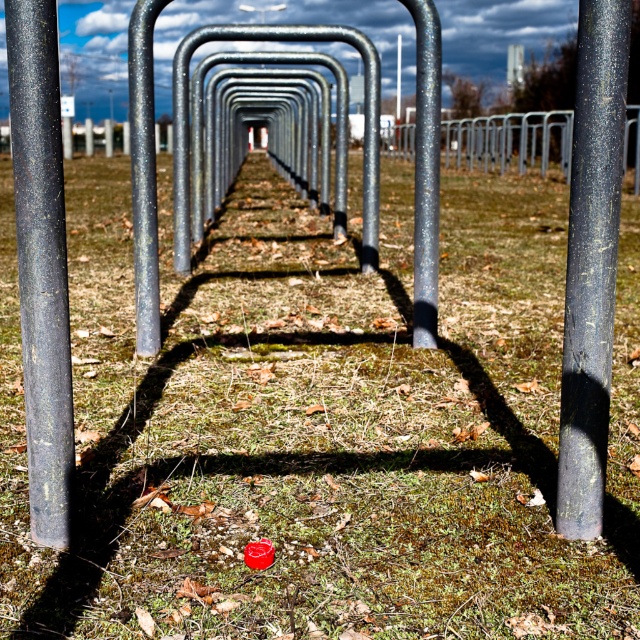
You are standing in front of the bike racks and want to touch both the matte black pole at left and the glossy metal pole at center. Which pole should you reach for first to touch the closer one?

You should reach for the matte black pole at left first because it is closer to you than the glossy metal pole at center.

You are standing in a parking lot with two poles, the black matte pole at right and the matte black pole at left. Which pole is taller?

The black matte pole at right is much taller than the matte black pole at left.